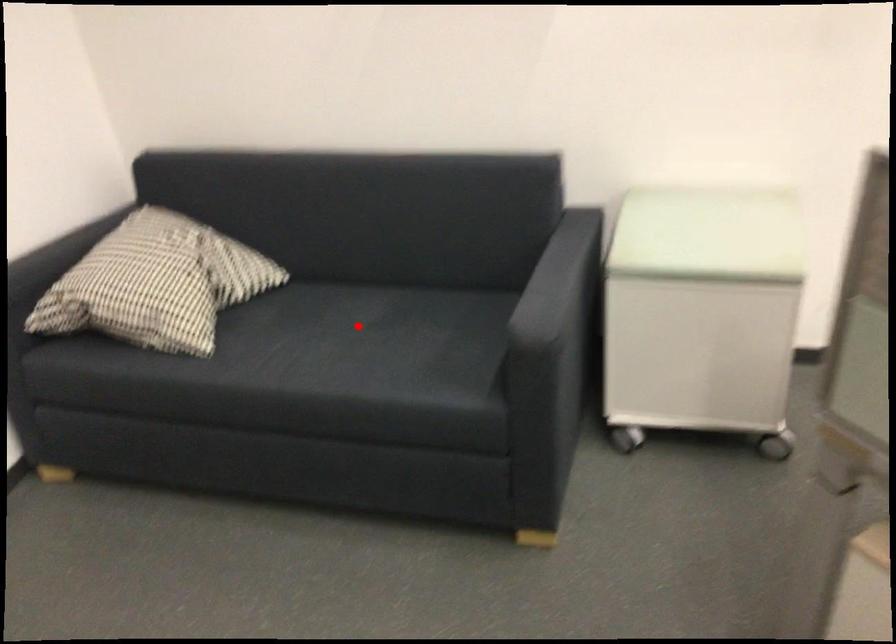
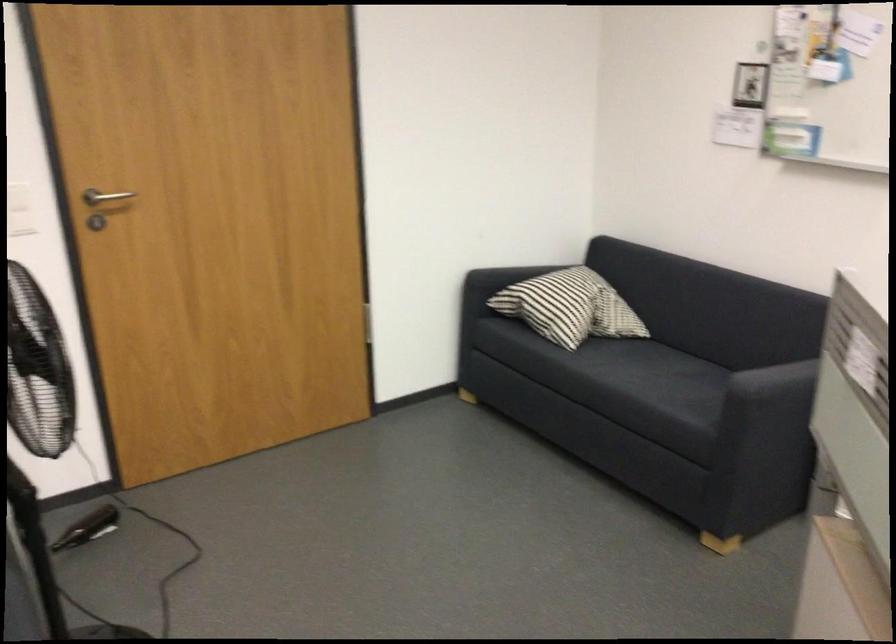
Question: I am providing you with two images of the same scene from different viewpoints. Given a red point in image1, look at the same physical point in image2. Is it:

Choices:
 (A) Closer to the viewpoint
 (B) Farther from the viewpoint

Answer: (B)